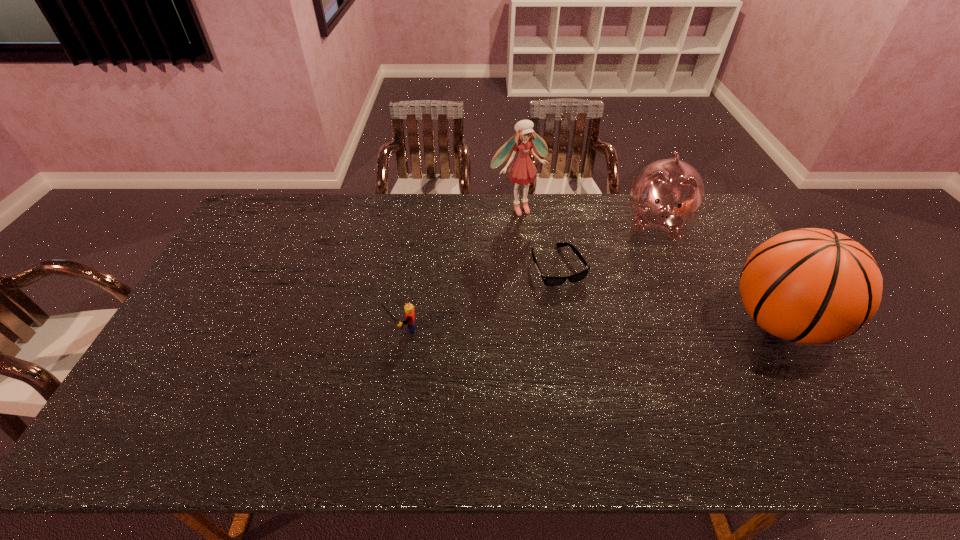
The width and height of the screenshot is (960, 540). I want to click on vacant space on the desktop that is between the leftmost object and the basketball and is positioned on the front-facing side of the shortest object, so [x=591, y=326].

Where is `vacant space on the desktop that is between the Lego and the basketball and is positioned on the front-facing side of the doll`? This screenshot has width=960, height=540. vacant space on the desktop that is between the Lego and the basketball and is positioned on the front-facing side of the doll is located at coordinates (612, 325).

Where is `vacant spot on the desktop that is between the Lego and the basketball and is positioned on the front facing side of the third shortest object`? vacant spot on the desktop that is between the Lego and the basketball and is positioned on the front facing side of the third shortest object is located at coordinates (645, 325).